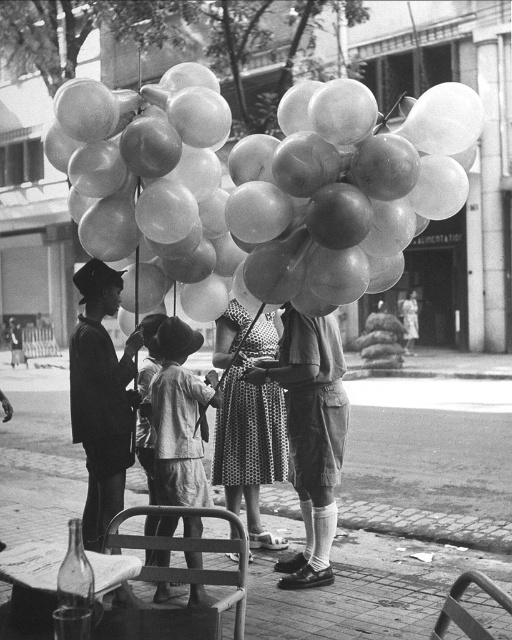
Question: Can you confirm if translucent rubber balloons at center is positioned to the right of polka dot dress at center?

Choices:
 (A) no
 (B) yes

Answer: (B)

Question: Which of the following is the closest to the observer?

Choices:
 (A) (77, 432)
 (B) (339, 474)

Answer: (A)

Question: Which object is positioned closest to the dark suit at center?

Choices:
 (A) translucent rubber balloons at center
 (B) matte khaki shorts at center
 (C) light gray cotton dress at center
 (D) polka dot dress at center

Answer: (C)

Question: Can you confirm if matte khaki shorts at center is positioned to the right of polka dot dress at center?

Choices:
 (A) yes
 (B) no

Answer: (A)

Question: Is polka dot dress at center above light gray cotton dress at center?

Choices:
 (A) no
 (B) yes

Answer: (B)

Question: Among these points, which one is farthest from the camera?

Choices:
 (A) (84, 380)
 (B) (247, 390)
 (C) (298, 412)

Answer: (B)